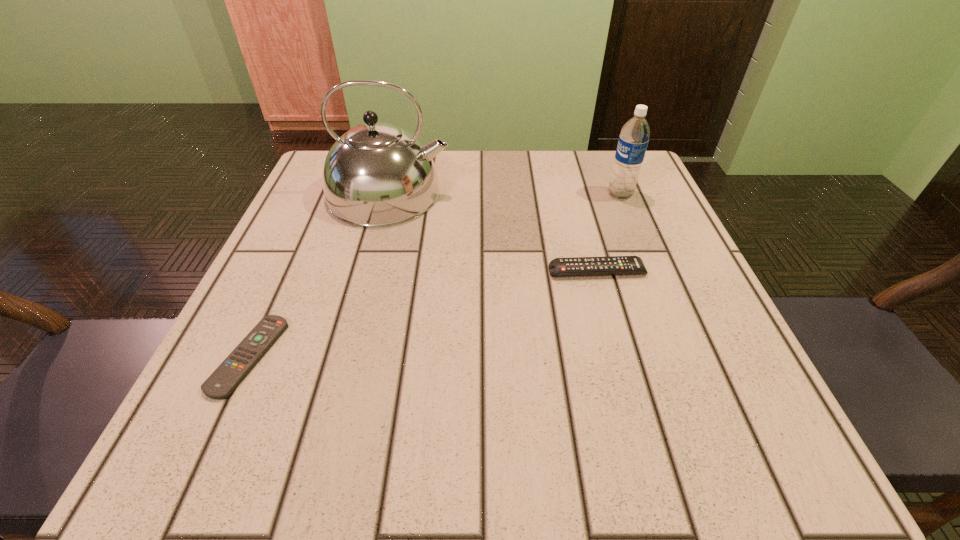
Locate an element on the screen. This screenshot has height=540, width=960. the tallest object is located at coordinates (377, 174).

Identify the location of water bottle. (634, 137).

Find the location of a particular element. This screenshot has width=960, height=540. the third farthest object is located at coordinates pos(611,265).

Image resolution: width=960 pixels, height=540 pixels. What are the coordinates of `the right remote control` in the screenshot? It's located at (611, 265).

You are a GUI agent. You are given a task and a screenshot of the screen. Output one action in this format:
    pyautogui.click(x=<x>, y=<y>)
    Task: Click on the left remote control
    The image size is (960, 540).
    Given the screenshot: What is the action you would take?
    pyautogui.click(x=231, y=372)

Identify the location of the shortest object. This screenshot has width=960, height=540. (231, 372).

Where is `vacant space located from the spout of the kettle`? vacant space located from the spout of the kettle is located at coordinates (502, 193).

The image size is (960, 540). I want to click on vacant space situated 0.150m on the front of the third shortest object, so click(x=642, y=247).

Identify the location of free space located on the front of the taller remote control. (633, 399).

This screenshot has width=960, height=540. I want to click on vacant space located on the front of the nearer remote control, so click(x=213, y=436).